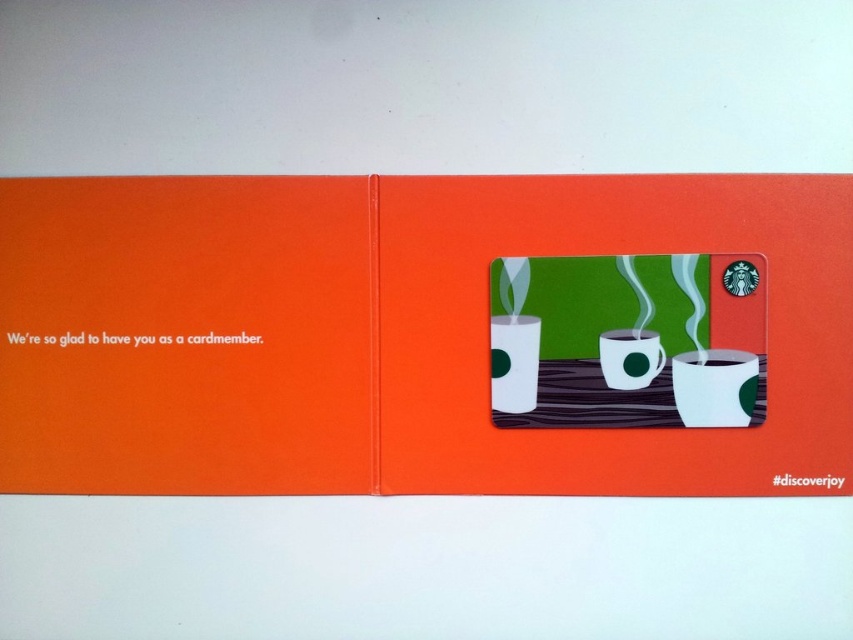
Is the position of white glossy mug at upper right more distant than that of white glossy mug at center?

No, white glossy mug at upper right is closer to the viewer.

Does white glossy mug at upper right lie in front of white glossy mug at center?

Yes, white glossy mug at upper right is in front of white glossy mug at center.

Identify the location of white glossy mug at upper right. The height and width of the screenshot is (640, 853). (715, 387).

How much distance is there between matte plastic starbucks card at right and white glossy mug at center?

matte plastic starbucks card at right and white glossy mug at center are 11.62 inches apart from each other.

Does point (635, 227) come farther from viewer compared to point (506, 401)?

No, (635, 227) is in front of (506, 401).

Between point (775, 371) and point (521, 403), which one is positioned behind?

The point (521, 403) is behind.

Find the location of `matte plastic starbucks card at right`. matte plastic starbucks card at right is located at coordinates (381, 333).

How distant is white glossy mug at center from green matte cup at center?

white glossy mug at center is 5.28 inches away from green matte cup at center.

Who is more forward, [535,384] or [643,348]?

Point [643,348] is in front.

Find the location of `white glossy mug at center`. white glossy mug at center is located at coordinates (514, 362).